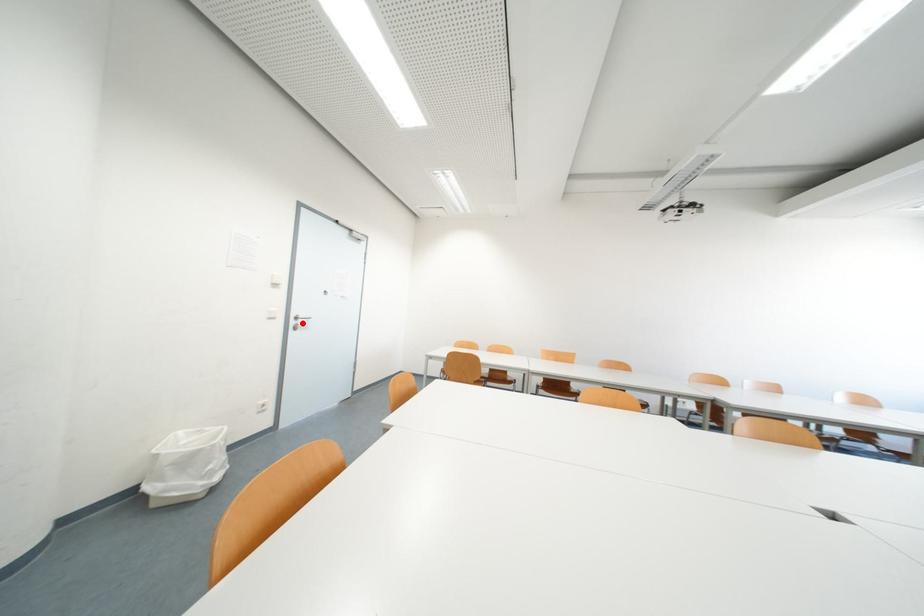
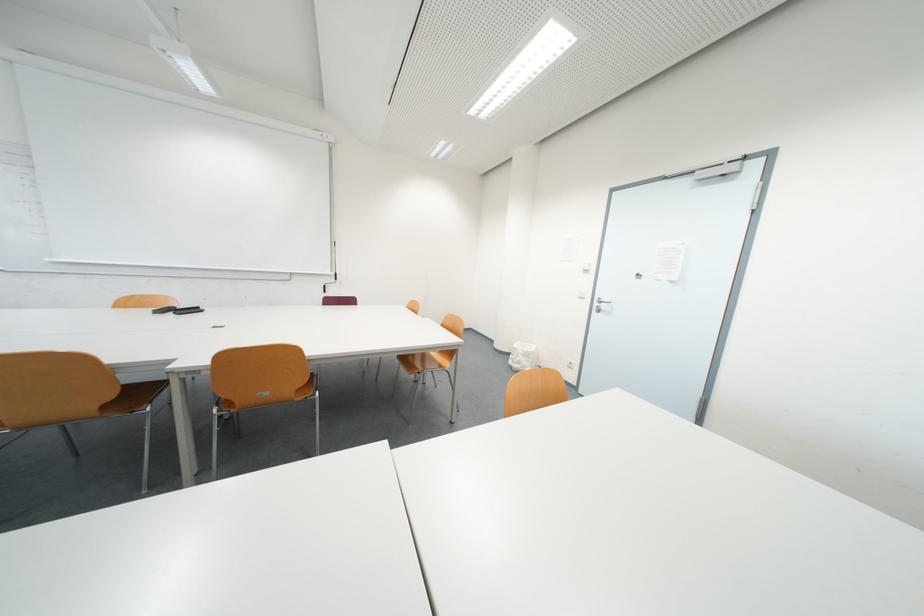
In the second image, find the point that corresponds to the highlighted location in the first image.

(605, 305)